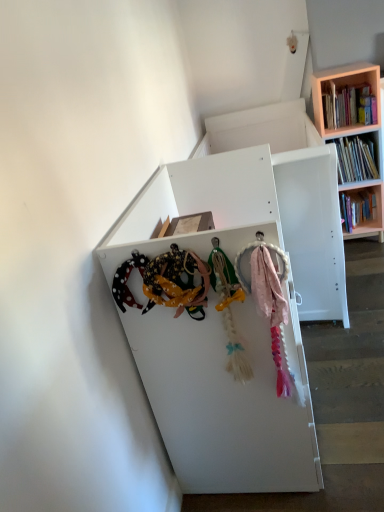
Question: Considering the relative positions of white matte shelf at center and wooden bookshelf at upper right in the image provided, is white matte shelf at center to the right of wooden bookshelf at upper right from the viewer's perspective?

Choices:
 (A) no
 (B) yes

Answer: (A)

Question: Are white matte shelf at center and wooden bookshelf at upper right located far from each other?

Choices:
 (A) no
 (B) yes

Answer: (B)

Question: Is white matte shelf at center looking in the opposite direction of wooden bookshelf at upper right?

Choices:
 (A) yes
 (B) no

Answer: (B)

Question: Is white matte shelf at center at the left side of wooden bookshelf at upper right?

Choices:
 (A) no
 (B) yes

Answer: (B)

Question: Would you say wooden bookshelf at upper right is part of white matte shelf at center's contents?

Choices:
 (A) yes
 (B) no

Answer: (B)

Question: Would you say white matte shelf at center is to the left or to the right of wooden bookshelf at upper right in the picture?

Choices:
 (A) left
 (B) right

Answer: (A)

Question: Is white matte shelf at center in front of or behind wooden bookshelf at upper right in the image?

Choices:
 (A) front
 (B) behind

Answer: (A)

Question: Is white matte shelf at center inside or outside of wooden bookshelf at upper right?

Choices:
 (A) inside
 (B) outside

Answer: (B)

Question: From a real-world perspective, is white matte shelf at center positioned above or below wooden bookshelf at upper right?

Choices:
 (A) below
 (B) above

Answer: (A)

Question: Would you say wooden bookshelf at upper right is to the left or to the right of white matte shelf at center in the picture?

Choices:
 (A) right
 (B) left

Answer: (A)

Question: Looking at the image, does wooden bookshelf at upper right seem bigger or smaller compared to white matte shelf at center?

Choices:
 (A) big
 (B) small

Answer: (B)

Question: From a real-world perspective, is wooden bookshelf at upper right physically located above or below white matte shelf at center?

Choices:
 (A) above
 (B) below

Answer: (A)

Question: In terms of height, does wooden bookshelf at upper right look taller or shorter compared to white matte shelf at center?

Choices:
 (A) tall
 (B) short

Answer: (B)

Question: In terms of size, does white matte shelf at center appear bigger or smaller than wooden bookshelf at upper right?

Choices:
 (A) big
 (B) small

Answer: (A)

Question: From the image's perspective, is white matte shelf at center positioned above or below wooden bookshelf at upper right?

Choices:
 (A) above
 (B) below

Answer: (B)